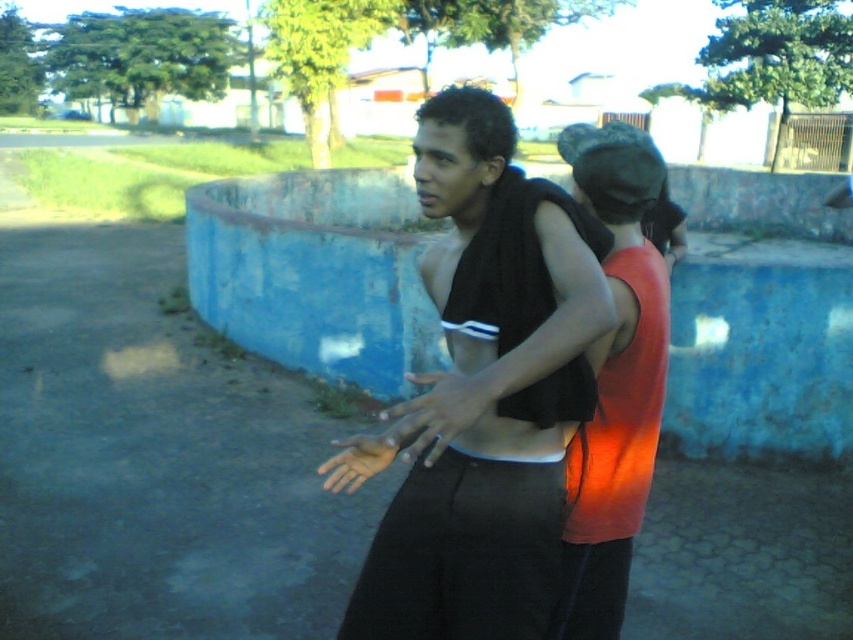
Question: Which object is positioned closest to the matte black tank top at center?

Choices:
 (A) orange matte tank top at center
 (B) matte black hand at center
 (C) smooth skin hand at center

Answer: (B)

Question: Which object is farther from the camera taking this photo?

Choices:
 (A) matte black hand at center
 (B) orange matte tank top at center

Answer: (B)

Question: Is matte black hand at center positioned at the back of smooth skin hand at center?

Choices:
 (A) yes
 (B) no

Answer: (B)

Question: Is orange matte tank top at center below smooth skin hand at center?

Choices:
 (A) yes
 (B) no

Answer: (B)

Question: Where is matte black tank top at center located in relation to matte black hand at center in the image?

Choices:
 (A) below
 (B) above

Answer: (A)

Question: Which object appears farthest from the camera in this image?

Choices:
 (A) matte black hand at center
 (B) matte black tank top at center
 (C) smooth skin hand at center

Answer: (C)